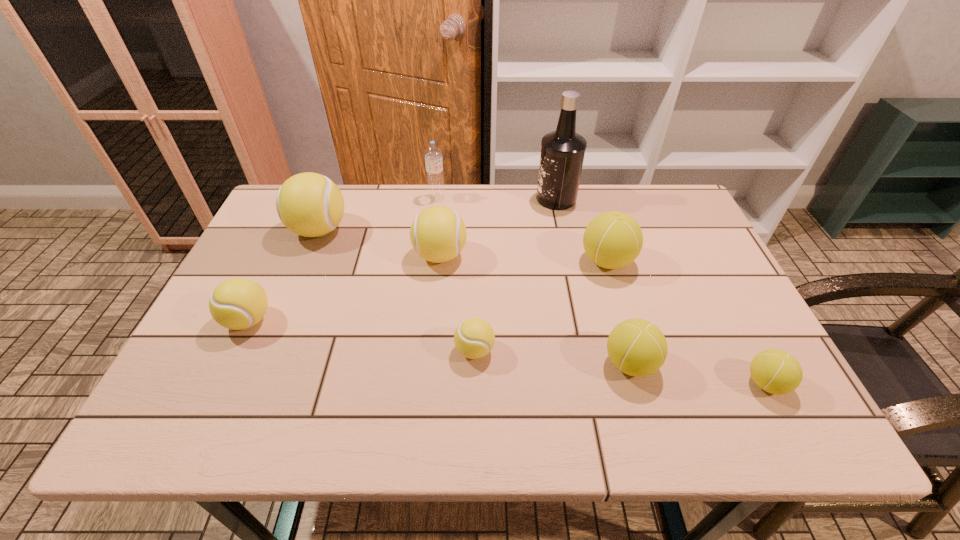
This screenshot has height=540, width=960. In order to click on blank space at the near edge of the desktop in this screenshot , I will do `click(300, 399)`.

Find the location of a particular element. The height and width of the screenshot is (540, 960). free space at the left edge of the desktop is located at coordinates (260, 241).

The height and width of the screenshot is (540, 960). Identify the location of free space at the right edge. (754, 338).

At what (x,y) coordinates should I click in order to perform the action: click on free space at the far left corner of the desktop. Please return your answer as a coordinate pair (x, y). The width and height of the screenshot is (960, 540). Looking at the image, I should click on (266, 225).

In the image, there is a desktop. Find the location of `vacant space at the near left corner`. vacant space at the near left corner is located at coordinates pyautogui.click(x=225, y=416).

At what (x,y) coordinates should I click in order to perform the action: click on vacant point located between the smallest yellow tennis ball and the second biggest yellow tennis ball. Please return your answer as a coordinate pair (x, y). This screenshot has height=540, width=960. Looking at the image, I should click on (457, 303).

At what (x,y) coordinates should I click in order to perform the action: click on free space that is in between the third smallest yellow tennis ball and the biggest green tennis ball. Please return your answer as a coordinate pair (x, y). The height and width of the screenshot is (540, 960). Looking at the image, I should click on tap(523, 259).

Where is `unoccupied area between the second biggest green tennis ball and the third biggest yellow tennis ball`? unoccupied area between the second biggest green tennis ball and the third biggest yellow tennis ball is located at coordinates (440, 342).

Where is `vacant area between the third smallest yellow tennis ball and the biggest green tennis ball`? vacant area between the third smallest yellow tennis ball and the biggest green tennis ball is located at coordinates (523, 259).

Where is `empty location between the second smallest yellow tennis ball and the water bottle`? Image resolution: width=960 pixels, height=540 pixels. empty location between the second smallest yellow tennis ball and the water bottle is located at coordinates (343, 259).